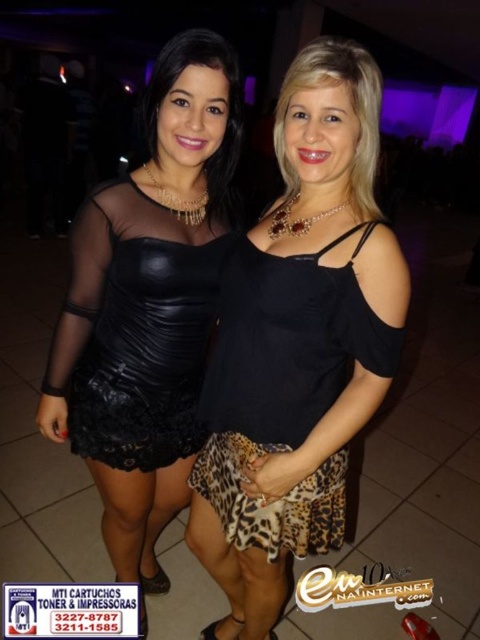
Question: Is leopard print skirt at center positioned at the back of black leather dress at left?

Choices:
 (A) yes
 (B) no

Answer: (B)

Question: Which point is farther to the camera?

Choices:
 (A) (162, 314)
 (B) (117, 260)
 (C) (236, 339)

Answer: (A)

Question: Can you confirm if matte black dress at center is positioned to the right of black leather dress at left?

Choices:
 (A) no
 (B) yes

Answer: (A)

Question: Can you confirm if leopard print skirt at center is positioned below black leather dress at left?

Choices:
 (A) no
 (B) yes

Answer: (B)

Question: Which object appears closest to the camera in this image?

Choices:
 (A) black leather dress at left
 (B) leopard print skirt at center

Answer: (B)

Question: Which object appears closest to the camera in this image?

Choices:
 (A) leopard print skirt at center
 (B) matte black dress at center
 (C) black leather dress at left

Answer: (A)